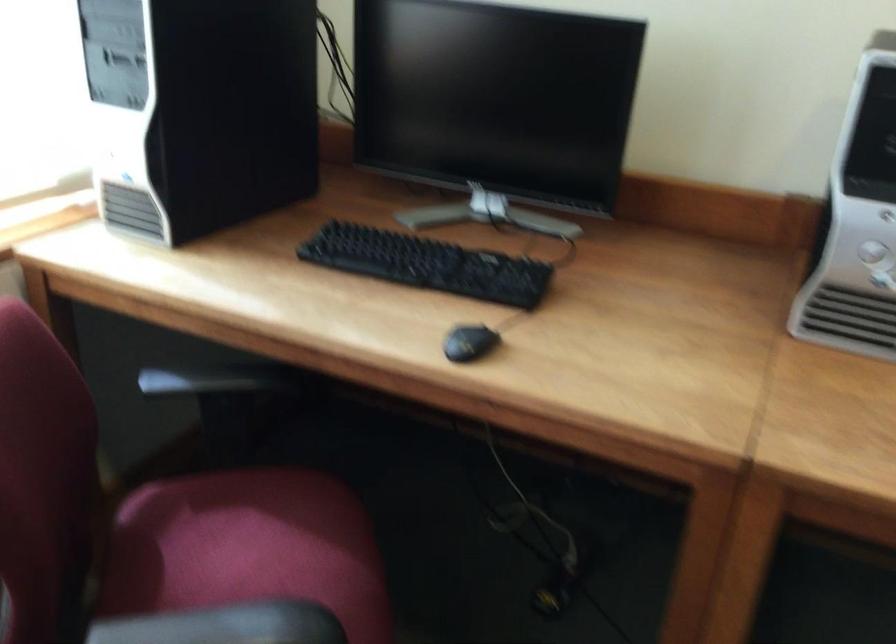
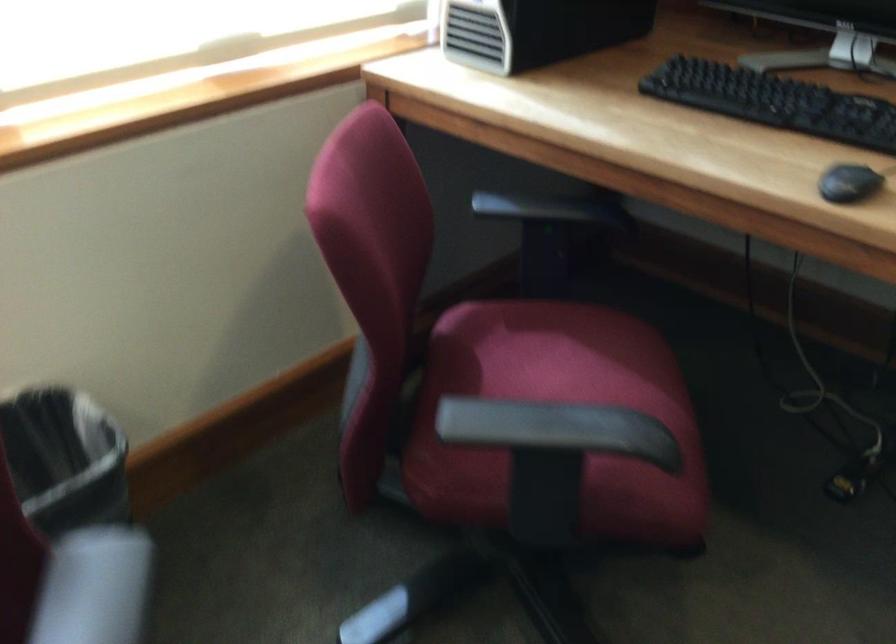
Locate, in the second image, the point that corresponds to point (227, 392) in the first image.

(555, 216)